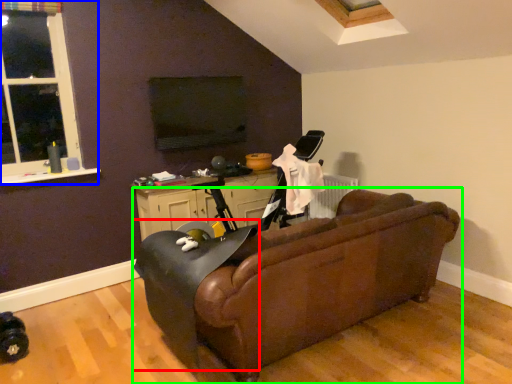
Question: Based on their relative distances, which object is farther from swivel chair (highlighted by a red box)? Choose from window (highlighted by a blue box) and studio couch (highlighted by a green box).

Choices:
 (A) window
 (B) studio couch

Answer: (A)